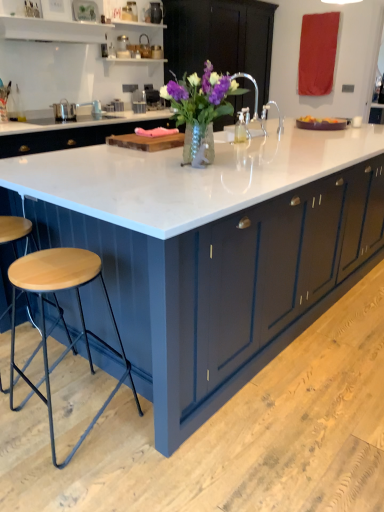
Question: Is wooden seat stool at lower left outside translucent glass vase with purple flowers at center?

Choices:
 (A) no
 (B) yes

Answer: (B)

Question: Does wooden seat stool at lower left have a lesser height compared to translucent glass vase with purple flowers at center?

Choices:
 (A) yes
 (B) no

Answer: (B)

Question: Is wooden seat stool at lower left taller than translucent glass vase with purple flowers at center?

Choices:
 (A) yes
 (B) no

Answer: (A)

Question: Can you confirm if wooden seat stool at lower left is thinner than translucent glass vase with purple flowers at center?

Choices:
 (A) yes
 (B) no

Answer: (B)

Question: Is translucent glass vase with purple flowers at center surrounded by wooden seat stool at lower left?

Choices:
 (A) no
 (B) yes

Answer: (A)

Question: Is wooden cutting board at center in front of or behind matte dark blue cabinet at center in the image?

Choices:
 (A) behind
 (B) front

Answer: (B)

Question: In terms of width, does wooden cutting board at center look wider or thinner when compared to matte dark blue cabinet at center?

Choices:
 (A) wide
 (B) thin

Answer: (B)

Question: In terms of size, does wooden cutting board at center appear bigger or smaller than matte dark blue cabinet at center?

Choices:
 (A) big
 (B) small

Answer: (B)

Question: Is point (139, 147) closer or farther from the camera than point (221, 118)?

Choices:
 (A) farther
 (B) closer

Answer: (B)

Question: Is matte dark blue cabinet at center taller or shorter than wooden seat stool at lower left?

Choices:
 (A) tall
 (B) short

Answer: (A)

Question: From the image's perspective, is matte dark blue cabinet at center above or below wooden seat stool at lower left?

Choices:
 (A) below
 (B) above

Answer: (B)

Question: Relative to wooden seat stool at lower left, is matte dark blue cabinet at center in front or behind?

Choices:
 (A) behind
 (B) front

Answer: (A)

Question: Is matte dark blue cabinet at center wider or thinner than wooden seat stool at lower left?

Choices:
 (A) wide
 (B) thin

Answer: (A)

Question: In terms of width, does translucent glass vase with purple flowers at center look wider or thinner when compared to white marble countertop at center?

Choices:
 (A) thin
 (B) wide

Answer: (A)

Question: Is translucent glass vase with purple flowers at center taller or shorter than white marble countertop at center?

Choices:
 (A) tall
 (B) short

Answer: (B)